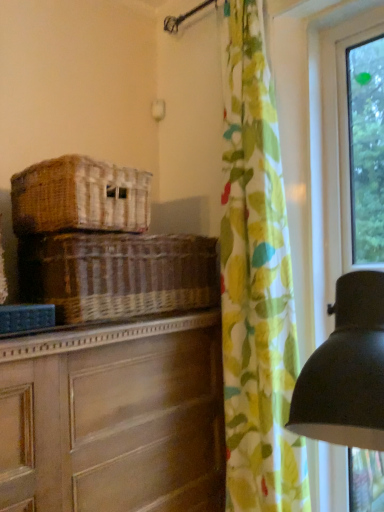
What do you see at coordinates (118, 274) in the screenshot? Image resolution: width=384 pixels, height=512 pixels. I see `woven brown basket at center, which is the first basket in bottom-to-top order` at bounding box center [118, 274].

Locate an element on the screen. This screenshot has width=384, height=512. floral fabric curtain at right is located at coordinates (256, 283).

Does point (17, 196) come farther from viewer compared to point (305, 488)?

No, (17, 196) is in front of (305, 488).

Is floral fabric curtain at right at the back of woven brown basket at left, which is counted as the 2th basket, starting from the bottom?

No, woven brown basket at left, which is counted as the 2th basket, starting from the bottom, is not facing away from floral fabric curtain at right.

In the scene shown: Considering the relative positions of woven brown basket at left, which is counted as the 2th basket, starting from the bottom, and floral fabric curtain at right in the image provided, is woven brown basket at left, which is counted as the 2th basket, starting from the bottom, to the left or to the right of floral fabric curtain at right?

woven brown basket at left, which is counted as the 2th basket, starting from the bottom, is to the left of floral fabric curtain at right.

Is floral fabric curtain at right wider than woven brown basket at left, arranged as the first basket when viewed from the top?

No, floral fabric curtain at right is not wider than woven brown basket at left, arranged as the first basket when viewed from the top.

Is floral fabric curtain at right oriented away from woven brown basket at left, arranged as the first basket when viewed from the top?

That's not correct — floral fabric curtain at right is not looking away from woven brown basket at left, arranged as the first basket when viewed from the top.

Considering the positions of point (286, 322) and point (38, 180), is point (286, 322) closer or farther from the camera than point (38, 180)?

Clearly, point (286, 322) is more distant from the camera than point (38, 180).

Is floral fabric curtain at right next to woven brown basket at left, which is counted as the 2th basket, starting from the bottom, and touching it?

No, floral fabric curtain at right is not making contact with woven brown basket at left, which is counted as the 2th basket, starting from the bottom.

Consider the image. Does woven brown basket at center, which is the first basket in bottom-to-top order, appear on the right side of wooden chest of drawers at left?

Indeed, woven brown basket at center, which is the first basket in bottom-to-top order, is positioned on the right side of wooden chest of drawers at left.

From the image's perspective, which one is positioned higher, woven brown basket at center, the second basket in the top-to-bottom sequence, or wooden chest of drawers at left?

woven brown basket at center, the second basket in the top-to-bottom sequence.

This screenshot has height=512, width=384. What are the coordinates of `chest of drawers below the woven brown basket at center, which is the first basket in bottom-to-top order (from a real-world perspective)` in the screenshot? It's located at (118, 416).

Which is in front, woven brown basket at center, the second basket in the top-to-bottom sequence, or wooden chest of drawers at left?

wooden chest of drawers at left is more forward.

Locate an element on the screen. The image size is (384, 512). the chest of drawers located in front of the woven brown basket at left, which is counted as the 2th basket, starting from the bottom is located at coordinates (118, 416).

From the picture: Is woven brown basket at left, arranged as the first basket when viewed from the top, behind wooden chest of drawers at left?

Yes, woven brown basket at left, arranged as the first basket when viewed from the top, is behind wooden chest of drawers at left.

In the scene shown: Considering the sizes of objects woven brown basket at left, arranged as the first basket when viewed from the top, and wooden chest of drawers at left in the image provided, who is thinner, woven brown basket at left, arranged as the first basket when viewed from the top, or wooden chest of drawers at left?

woven brown basket at left, arranged as the first basket when viewed from the top, is thinner.

How many degrees apart are the facing directions of floral fabric curtain at right and wooden chest of drawers at left?

The facing directions of floral fabric curtain at right and wooden chest of drawers at left are 90.2 degrees apart.

Which point is more forward, (x=228, y=23) or (x=168, y=404)?

The point (x=168, y=404) is closer to the camera.

Would you say floral fabric curtain at right is inside or outside wooden chest of drawers at left?

floral fabric curtain at right cannot be found inside wooden chest of drawers at left.

In the scene shown: Which of these two, floral fabric curtain at right or wooden chest of drawers at left, stands taller?

Standing taller between the two is floral fabric curtain at right.

From a real-world perspective, is floral fabric curtain at right positioned above or below woven brown basket at center, which is the first basket in bottom-to-top order?

floral fabric curtain at right is situated higher than woven brown basket at center, which is the first basket in bottom-to-top order, in the real world.

Who is more distant, floral fabric curtain at right or woven brown basket at center, which is the first basket in bottom-to-top order?

floral fabric curtain at right is behind.

From the picture: Who is smaller, floral fabric curtain at right or woven brown basket at center, which is the first basket in bottom-to-top order?

woven brown basket at center, which is the first basket in bottom-to-top order, is smaller.

Based on the photo, how different are the orientations of floral fabric curtain at right and woven brown basket at center, the second basket in the top-to-bottom sequence, in degrees?

The angular difference between floral fabric curtain at right and woven brown basket at center, the second basket in the top-to-bottom sequence, is 86.3 degrees.

From the image's perspective, relative to woven brown basket at center, which is the first basket in bottom-to-top order, is wooden chest of drawers at left above or below?

wooden chest of drawers at left is below woven brown basket at center, which is the first basket in bottom-to-top order.

Looking at their sizes, would you say wooden chest of drawers at left is wider or thinner than woven brown basket at center, which is the first basket in bottom-to-top order?

In the image, wooden chest of drawers at left appears to be wider than woven brown basket at center, which is the first basket in bottom-to-top order.

Which is more to the right, wooden chest of drawers at left or woven brown basket at center, which is the first basket in bottom-to-top order?

From the viewer's perspective, woven brown basket at center, which is the first basket in bottom-to-top order, appears more on the right side.

From the image's perspective, which basket is the 1st one above the wooden chest of drawers at left? Please provide its 2D coordinates.

[(118, 274)]

At what (x,y) coordinates should I click in order to perform the action: click on curtain on the right of woven brown basket at left, which is counted as the 2th basket, starting from the bottom. Please return your answer as a coordinate pair (x, y). Looking at the image, I should click on (256, 283).

I want to click on curtain located below the woven brown basket at left, which is counted as the 2th basket, starting from the bottom (from the image's perspective), so click(x=256, y=283).

Based on their spatial positions, is woven brown basket at left, arranged as the first basket when viewed from the top, or woven brown basket at center, the second basket in the top-to-bottom sequence, further from wooden chest of drawers at left?

woven brown basket at left, arranged as the first basket when viewed from the top, is positioned further to the anchor wooden chest of drawers at left.

Looking at the image, which one is located closer to wooden chest of drawers at left, woven brown basket at left, which is counted as the 2th basket, starting from the bottom, or floral fabric curtain at right?

floral fabric curtain at right is closer to wooden chest of drawers at left.

Based on their spatial positions, is woven brown basket at center, the second basket in the top-to-bottom sequence, or wooden chest of drawers at left closer to floral fabric curtain at right?

wooden chest of drawers at left is positioned closer to the anchor floral fabric curtain at right.

Based on their spatial positions, is woven brown basket at center, the second basket in the top-to-bottom sequence, or wooden chest of drawers at left closer to woven brown basket at left, arranged as the first basket when viewed from the top?

woven brown basket at center, the second basket in the top-to-bottom sequence.

Estimate the real-world distances between objects in this image. Which object is further from wooden chest of drawers at left, woven brown basket at center, which is the first basket in bottom-to-top order, or floral fabric curtain at right?

The object further to wooden chest of drawers at left is floral fabric curtain at right.

Based on their spatial positions, is floral fabric curtain at right or woven brown basket at left, which is counted as the 2th basket, starting from the bottom, closer to woven brown basket at center, which is the first basket in bottom-to-top order?

The object closer to woven brown basket at center, which is the first basket in bottom-to-top order, is woven brown basket at left, which is counted as the 2th basket, starting from the bottom.

From the image, which object appears to be nearer to woven brown basket at center, which is the first basket in bottom-to-top order, woven brown basket at left, arranged as the first basket when viewed from the top, or floral fabric curtain at right?

Based on the image, woven brown basket at left, arranged as the first basket when viewed from the top, appears to be nearer to woven brown basket at center, which is the first basket in bottom-to-top order.

Looking at the image, which one is located closer to wooden chest of drawers at left, floral fabric curtain at right or woven brown basket at center, the second basket in the top-to-bottom sequence?

woven brown basket at center, the second basket in the top-to-bottom sequence, lies closer to wooden chest of drawers at left than the other object.

Where is `basket between woven brown basket at left, which is counted as the 2th basket, starting from the bottom, and floral fabric curtain at right from left to right`? The width and height of the screenshot is (384, 512). basket between woven brown basket at left, which is counted as the 2th basket, starting from the bottom, and floral fabric curtain at right from left to right is located at coordinates (118, 274).

Identify the location of basket between floral fabric curtain at right and wooden chest of drawers at left in the up-down direction. (118, 274).

The width and height of the screenshot is (384, 512). Find the location of `curtain between woven brown basket at left, arranged as the first basket when viewed from the top, and wooden chest of drawers at left, in the vertical direction`. curtain between woven brown basket at left, arranged as the first basket when viewed from the top, and wooden chest of drawers at left, in the vertical direction is located at coordinates [x=256, y=283].

Image resolution: width=384 pixels, height=512 pixels. Find the location of `basket between woven brown basket at left, arranged as the first basket when viewed from the top, and wooden chest of drawers at left in the up-down direction`. basket between woven brown basket at left, arranged as the first basket when viewed from the top, and wooden chest of drawers at left in the up-down direction is located at coordinates (118, 274).